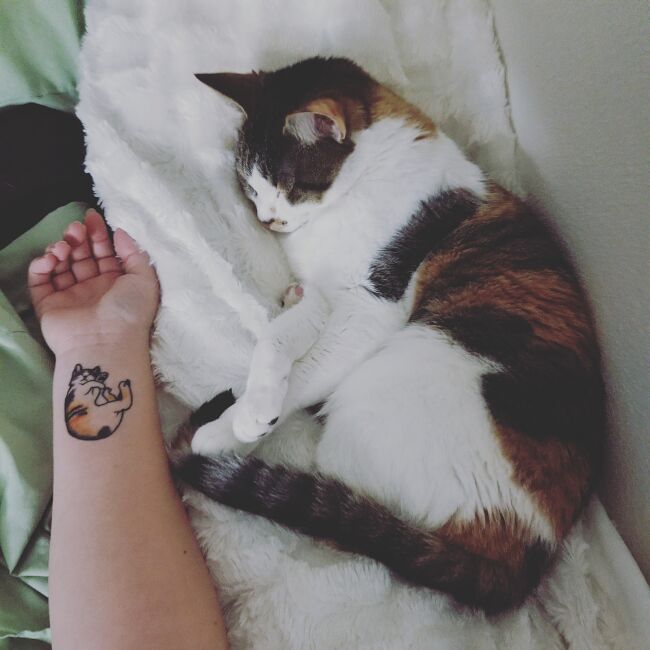
Where is `wall behind cat`? wall behind cat is located at coordinates (593, 253).